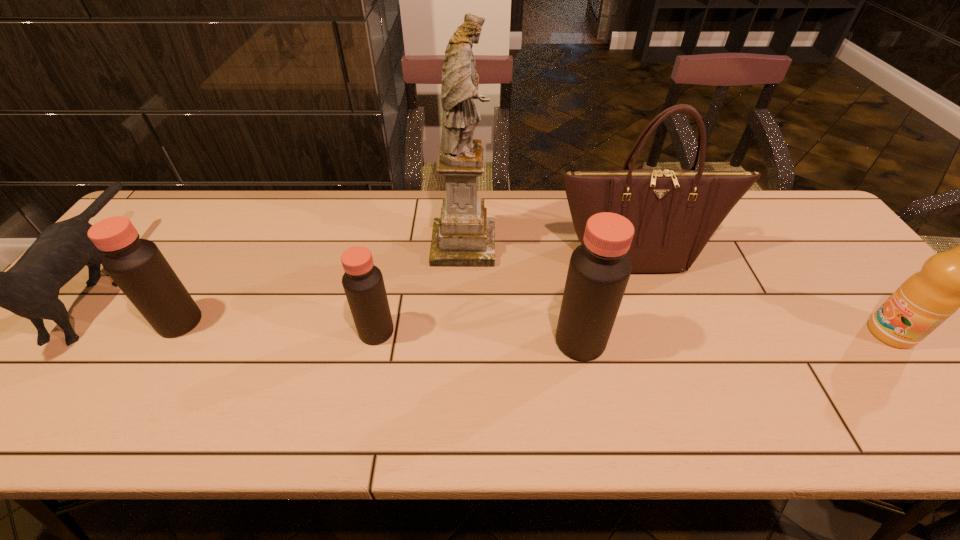
Locate an element on the screen. handbag positioned at the far edge is located at coordinates (674, 212).

Identify the location of vinegar at the near edge. (599, 270).

Identify the location of cat present at the near edge. (30, 289).

Locate an element on the screen. Image resolution: width=960 pixels, height=540 pixels. object that is at the left edge is located at coordinates (30, 289).

Find the location of a particular element. object at the right edge is located at coordinates (957, 278).

The height and width of the screenshot is (540, 960). Identify the location of object that is at the far left corner. (30, 289).

Where is `object at the near left corner`? Image resolution: width=960 pixels, height=540 pixels. object at the near left corner is located at coordinates (30, 289).

Identify the location of vacant space at the far edge of the desktop. The width and height of the screenshot is (960, 540). (415, 200).

In the image, there is a desktop. Identify the location of vacant space at the near edge. coord(268,395).

In the image, there is a desktop. Identify the location of vacant region at the left edge. (106, 299).